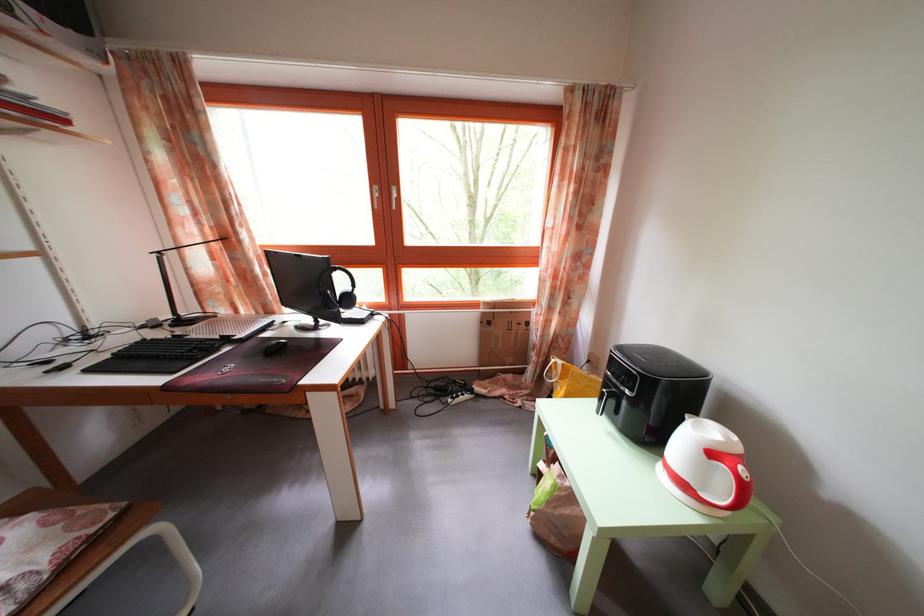
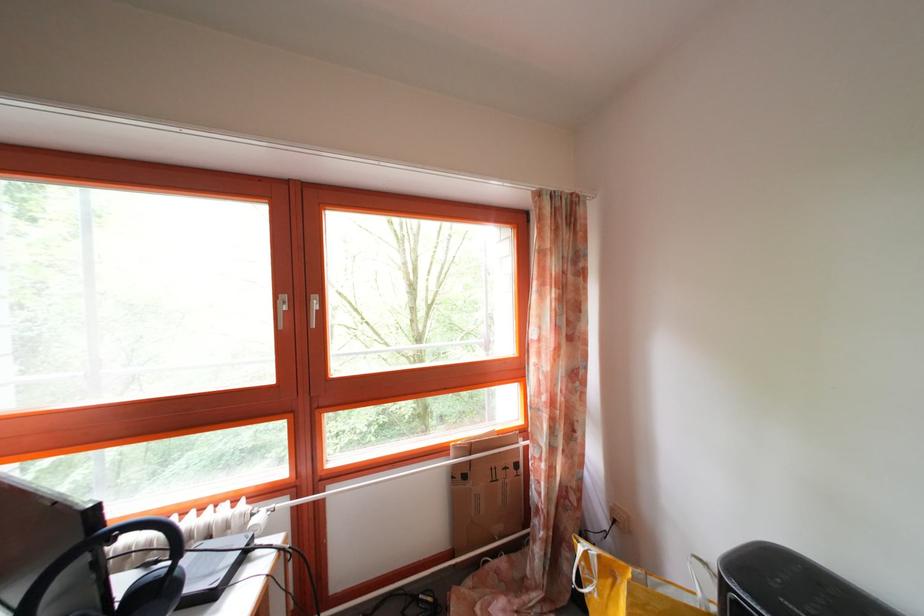
Find the pixel in the second image that matches point 360,297 in the first image.

(179, 573)